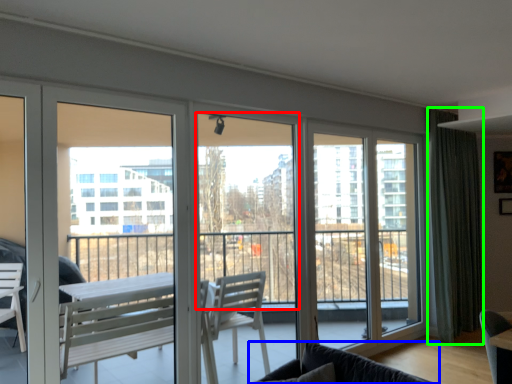
Question: Based on their relative distances, which object is farther from window screen (highlighted by a red box)? Choose from studio couch (highlighted by a blue box) and curtain (highlighted by a green box).

Choices:
 (A) studio couch
 (B) curtain

Answer: (B)